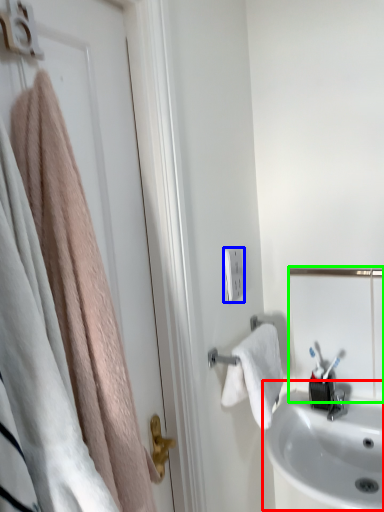
Question: Considering the real-world distances, which object is closest to sink (highlighted by a red box)? light switch (highlighted by a blue box) or mirror (highlighted by a green box).

Choices:
 (A) light switch
 (B) mirror

Answer: (B)